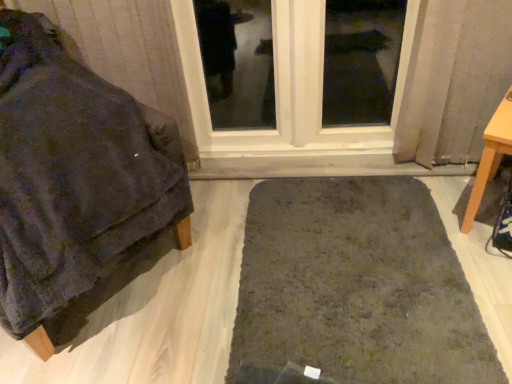
Question: Considering the relative sizes of light brown wooden table at right, the 2th furniture viewed from the left, and dark green shaggy rug at center in the image provided, is light brown wooden table at right, the 2th furniture viewed from the left, taller than dark green shaggy rug at center?

Choices:
 (A) yes
 (B) no

Answer: (A)

Question: Does light brown wooden table at right, the 2th furniture viewed from the left, lie in front of dark green shaggy rug at center?

Choices:
 (A) yes
 (B) no

Answer: (B)

Question: Is dark green shaggy rug at center surrounded by light brown wooden table at right, positioned as the first furniture in right-to-left order?

Choices:
 (A) yes
 (B) no

Answer: (B)

Question: Considering the relative sizes of light brown wooden table at right, the 2th furniture viewed from the left, and dark green shaggy rug at center in the image provided, is light brown wooden table at right, the 2th furniture viewed from the left, smaller than dark green shaggy rug at center?

Choices:
 (A) yes
 (B) no

Answer: (A)

Question: Can we say light brown wooden table at right, positioned as the first furniture in right-to-left order, lies outside dark green shaggy rug at center?

Choices:
 (A) no
 (B) yes

Answer: (B)

Question: Does point (95, 178) appear closer or farther from the camera than point (281, 354)?

Choices:
 (A) farther
 (B) closer

Answer: (B)

Question: Looking at their shapes, would you say velvety dark gray blanket at left, which is counted as the first furniture, starting from the left, is wider or thinner than dark green shaggy rug at center?

Choices:
 (A) thin
 (B) wide

Answer: (A)

Question: From a real-world perspective, is velvety dark gray blanket at left, which is counted as the first furniture, starting from the left, positioned above or below dark green shaggy rug at center?

Choices:
 (A) above
 (B) below

Answer: (A)

Question: From the image's perspective, relative to dark green shaggy rug at center, is velvety dark gray blanket at left, positioned as the second furniture in right-to-left order, above or below?

Choices:
 (A) below
 (B) above

Answer: (B)

Question: Is clear glass window at center inside the boundaries of light brown wooden table at right, the 2th furniture viewed from the left, or outside?

Choices:
 (A) inside
 (B) outside

Answer: (B)

Question: Visually, is clear glass window at center positioned to the left or to the right of light brown wooden table at right, the 2th furniture viewed from the left?

Choices:
 (A) right
 (B) left

Answer: (B)

Question: Considering the positions of point (209, 144) and point (484, 173), is point (209, 144) closer or farther from the camera than point (484, 173)?

Choices:
 (A) closer
 (B) farther

Answer: (B)

Question: In terms of height, does clear glass window at center look taller or shorter compared to light brown wooden table at right, positioned as the first furniture in right-to-left order?

Choices:
 (A) short
 (B) tall

Answer: (B)

Question: From a real-world perspective, is velvety dark gray blanket at left, which is counted as the first furniture, starting from the left, positioned above or below clear glass window at center?

Choices:
 (A) above
 (B) below

Answer: (A)

Question: Does point (69, 271) appear closer or farther from the camera than point (202, 135)?

Choices:
 (A) farther
 (B) closer

Answer: (B)